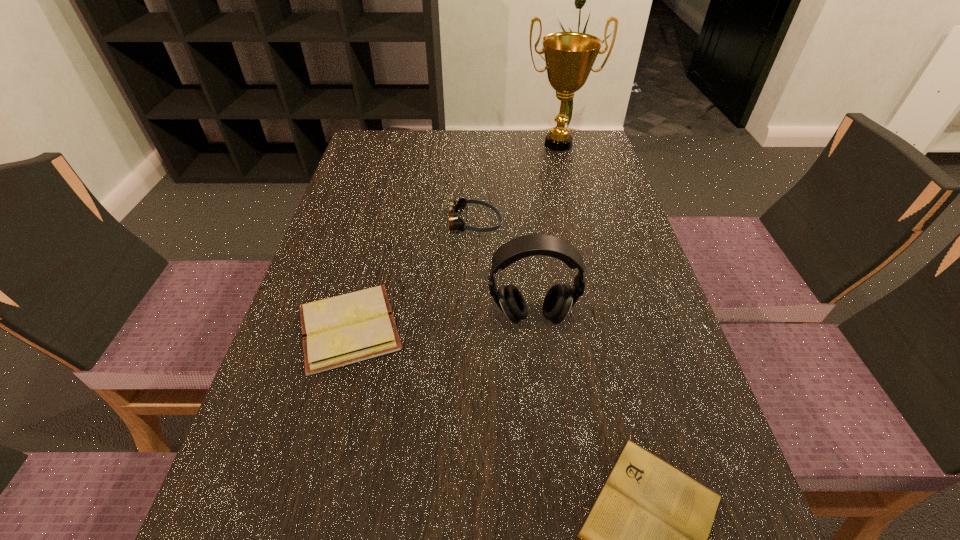
Find the location of a particular element. free space located on the front of the leftmost object is located at coordinates (326, 415).

Locate an element on the screen. object located in the far edge section of the desktop is located at coordinates (569, 56).

You are a GUI agent. You are given a task and a screenshot of the screen. Output one action in this format:
    pyautogui.click(x=<x>, y=<y>)
    Task: Click on the object situated at the left edge
    The height and width of the screenshot is (540, 960).
    Given the screenshot: What is the action you would take?
    pyautogui.click(x=341, y=330)

Where is `object situated at the right edge`? Image resolution: width=960 pixels, height=540 pixels. object situated at the right edge is located at coordinates [x=569, y=56].

Where is `object situated at the far right corner`? The image size is (960, 540). object situated at the far right corner is located at coordinates (569, 56).

In the image, there is a desktop. Identify the location of free space at the far edge. (423, 168).

Identify the location of vacant space at the left edge. (343, 193).

Where is `free space at the right edge`? The image size is (960, 540). free space at the right edge is located at coordinates (604, 207).

Image resolution: width=960 pixels, height=540 pixels. In the image, there is a desktop. Find the location of `vacant space at the far left corner`. vacant space at the far left corner is located at coordinates coord(368,130).

Where is `vacant area at the far right corner of the desktop`? The image size is (960, 540). vacant area at the far right corner of the desktop is located at coordinates (598, 141).